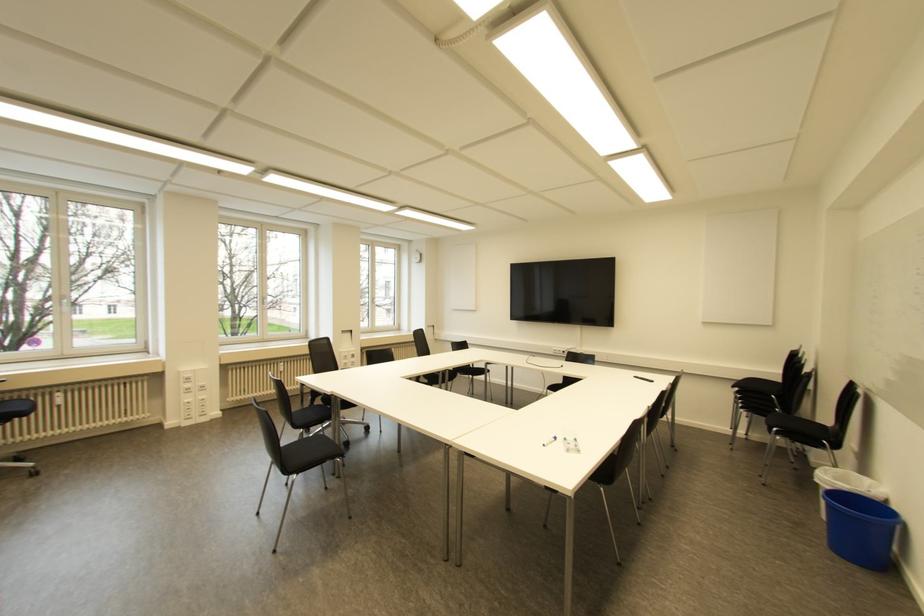
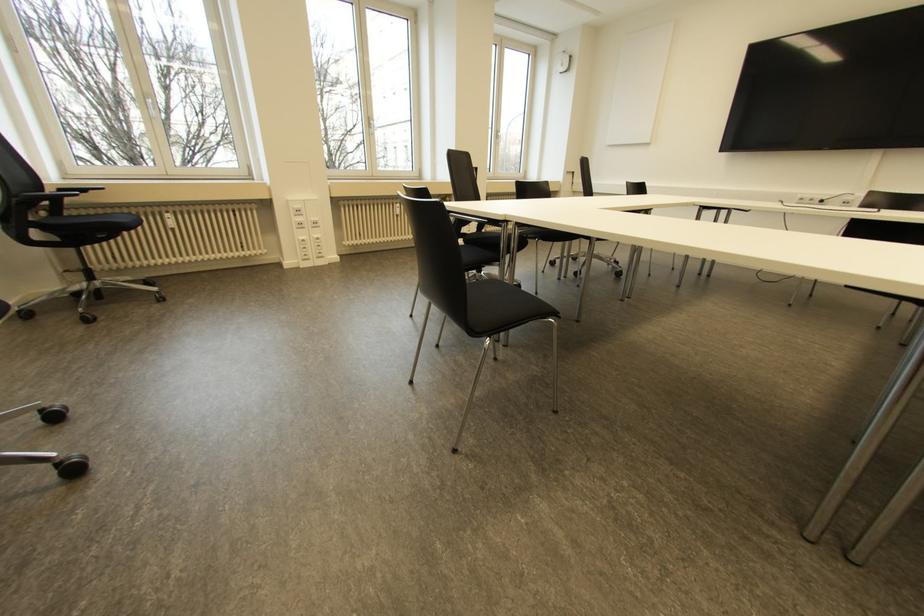
Which direction would the cameraman need to move to produce the second image?

The cameraman moved toward left, forward.